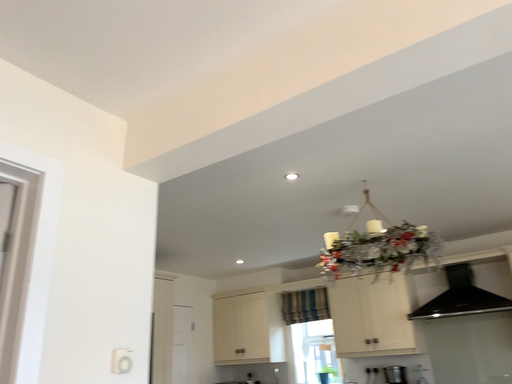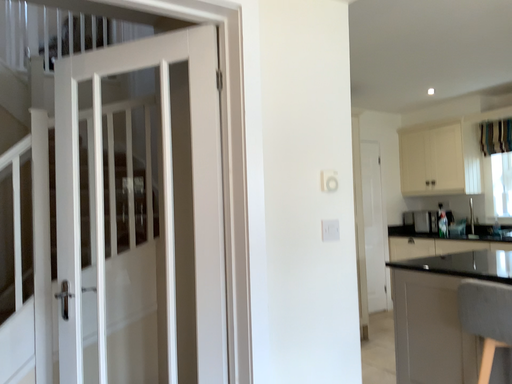
Question: How did the camera likely rotate when shooting the video?

Choices:
 (A) rotated left
 (B) rotated right

Answer: (A)